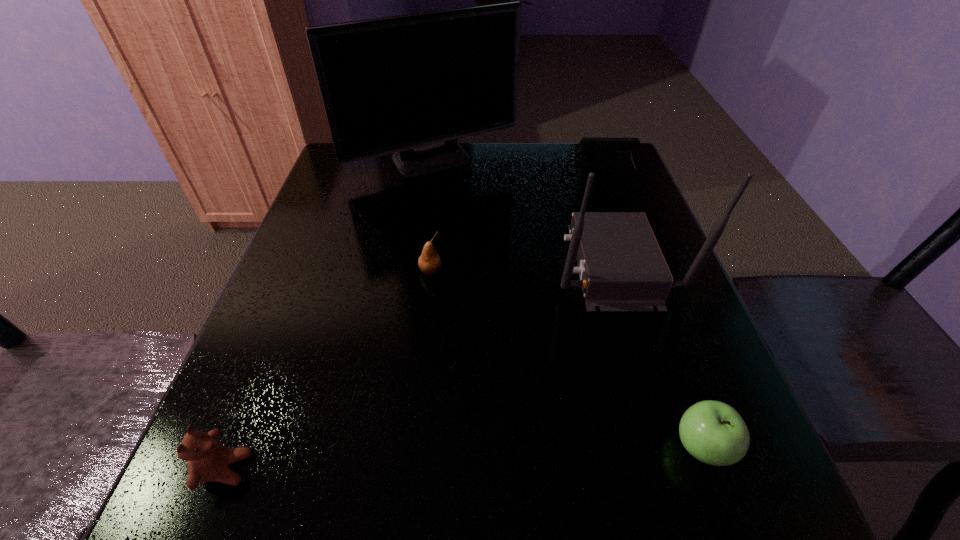
Locate an element on the screen. The height and width of the screenshot is (540, 960). computer monitor is located at coordinates (412, 84).

The image size is (960, 540). Identify the location of the fifth shortest object. (621, 267).

I want to click on pistol, so click(x=621, y=148).

At what (x,y) coordinates should I click in order to perform the action: click on pear. Please return your answer as a coordinate pair (x, y). The image size is (960, 540). Looking at the image, I should click on (429, 262).

Where is `teddy bear`? teddy bear is located at coordinates (207, 459).

This screenshot has width=960, height=540. In order to click on apple in this screenshot , I will do [713, 432].

Locate an element on the screen. The image size is (960, 540). vacant area situated on the front-facing side of the computer monitor is located at coordinates (414, 300).

Find the location of `vacant space located on the back of the router to connect cables`. vacant space located on the back of the router to connect cables is located at coordinates (472, 265).

Locate an element on the screen. Image resolution: width=960 pixels, height=540 pixels. free space located on the back of the router to connect cables is located at coordinates (492, 265).

The width and height of the screenshot is (960, 540). Identify the location of free space located 0.190m on the back of the router to connect cables. (463, 265).